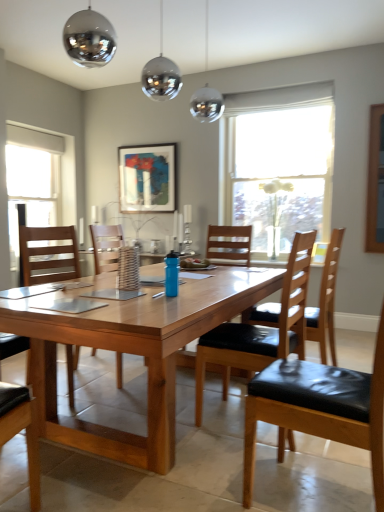
The height and width of the screenshot is (512, 384). Describe the element at coordinates (128, 269) in the screenshot. I see `woven brown basket at center` at that location.

This screenshot has width=384, height=512. What do you see at coordinates (171, 274) in the screenshot?
I see `blue matte water bottle at center` at bounding box center [171, 274].

What do you see at coordinates (326, 301) in the screenshot?
I see `black leather chair at right, marked as the fourth chair in a left-to-right arrangement` at bounding box center [326, 301].

This screenshot has width=384, height=512. I want to click on woven brown basket at center, so click(x=128, y=269).

Where is `desk on the left of the black leather chair at center, which ranks as the second chair in left-to-right order`? This screenshot has height=512, width=384. desk on the left of the black leather chair at center, which ranks as the second chair in left-to-right order is located at coordinates (132, 353).

Considering the relative sizes of black leather chair at center, which ranks as the second chair in left-to-right order, and wooden table at center in the image provided, is black leather chair at center, which ranks as the second chair in left-to-right order, bigger than wooden table at center?

No.

Is black leather chair at center, arranged as the 3th chair when viewed from the right, in contact with wooden table at center?

No, black leather chair at center, arranged as the 3th chair when viewed from the right, is not with wooden table at center.

Is black leather chair at center, arranged as the 3th chair when viewed from the right, oriented away from wooden table at center?

That's not correct — black leather chair at center, arranged as the 3th chair when viewed from the right, is not looking away from wooden table at center.

Between wooden chair at center, marked as the 4th chair in a right-to-left arrangement, and black leather chair at right, marked as the first chair in a right-to-left arrangement, which one is positioned behind?

black leather chair at right, marked as the first chair in a right-to-left arrangement, is behind.

Would you say wooden chair at center, marked as the 4th chair in a right-to-left arrangement, is a long distance from black leather chair at right, marked as the first chair in a right-to-left arrangement?

Yes, wooden chair at center, marked as the 4th chair in a right-to-left arrangement, and black leather chair at right, marked as the first chair in a right-to-left arrangement, are quite far apart.

Between wooden chair at center, marked as the 4th chair in a right-to-left arrangement, and black leather chair at right, marked as the fourth chair in a left-to-right arrangement, which one has less height?

wooden chair at center, marked as the 4th chair in a right-to-left arrangement, is shorter.

Who is smaller, wooden chair at center, arranged as the first chair when viewed from the left, or black leather chair at right, marked as the fourth chair in a left-to-right arrangement?

black leather chair at right, marked as the fourth chair in a left-to-right arrangement.

Is black leather chair at right, marked as the fourth chair in a left-to-right arrangement, bigger than white glass window at left, which ranks as the second window in right-to-left order?

Indeed, black leather chair at right, marked as the fourth chair in a left-to-right arrangement, has a larger size compared to white glass window at left, which ranks as the second window in right-to-left order.

Looking at their sizes, would you say black leather chair at right, marked as the fourth chair in a left-to-right arrangement, is wider or thinner than white glass window at left, the 1th window when ordered from left to right?

In the image, black leather chair at right, marked as the fourth chair in a left-to-right arrangement, appears to be wider than white glass window at left, the 1th window when ordered from left to right.

Which point is more forward, (x=332, y=253) or (x=9, y=169)?

The point (x=332, y=253) is more forward.

Considering the relative sizes of shiny metallic globe at upper center and matte black picture frame at upper center in the image provided, is shiny metallic globe at upper center smaller than matte black picture frame at upper center?

Incorrect, shiny metallic globe at upper center is not smaller in size than matte black picture frame at upper center.

From the image's perspective, between shiny metallic globe at upper center and matte black picture frame at upper center, who is located below?

matte black picture frame at upper center, from the image's perspective.

Consider the image. From a real-world perspective, is shiny metallic globe at upper center located beneath matte black picture frame at upper center?

No, from a real-world perspective, shiny metallic globe at upper center is not beneath matte black picture frame at upper center.

Which object is closer to the camera taking this photo, wooden table at center or white glass window at left, which ranks as the second window in right-to-left order?

wooden table at center is in front.

From the image's perspective, which is below, wooden table at center or white glass window at left, which ranks as the second window in right-to-left order?

wooden table at center.

The image size is (384, 512). In order to click on desk below the white glass window at left, the 1th window when ordered from left to right (from a real-world perspective) in this screenshot , I will do `click(132, 353)`.

Can you confirm if wooden table at center is positioned to the right of white glass window at left, the 1th window when ordered from left to right?

Yes, wooden table at center is to the right of white glass window at left, the 1th window when ordered from left to right.

Considering the relative sizes of blue matte water bottle at center and black leather chair at center, which ranks as the second chair in left-to-right order, in the image provided, is blue matte water bottle at center thinner than black leather chair at center, which ranks as the second chair in left-to-right order,?

Correct, the width of blue matte water bottle at center is less than that of black leather chair at center, which ranks as the second chair in left-to-right order.

Could you measure the distance between blue matte water bottle at center and black leather chair at center, arranged as the 3th chair when viewed from the right?

blue matte water bottle at center and black leather chair at center, arranged as the 3th chair when viewed from the right, are 25.39 inches apart from each other.

Are blue matte water bottle at center and black leather chair at center, which ranks as the second chair in left-to-right order, located far from each other?

They are positioned close to each other.

What's the angular difference between blue matte water bottle at center and black leather chair at center, arranged as the 3th chair when viewed from the right,'s facing directions?

They differ by 176 degrees in their facing directions.

Is wooden table at center positioned with its back to black leather chair at right, marked as the second chair in a right-to-left arrangement?

No, black leather chair at right, marked as the second chair in a right-to-left arrangement, is not at the back of wooden table at center.

Between point (155, 393) and point (271, 393), which one is positioned behind?

Positioned behind is point (155, 393).

Does wooden table at center have a greater height compared to black leather chair at right, marked as the second chair in a right-to-left arrangement?

In fact, wooden table at center may be shorter than black leather chair at right, marked as the second chair in a right-to-left arrangement.

How many degrees apart are the facing directions of wooden table at center and black leather chair at right, marked as the second chair in a right-to-left arrangement?

95.3 degrees.

You are a GUI agent. You are given a task and a screenshot of the screen. Output one action in this format:
    pyautogui.click(x=<x>, y=<y>)
    Task: Click on the chair that is the 1st one above the wooden table at center (from a real-world perspective)
    The height and width of the screenshot is (512, 384).
    Given the screenshot: What is the action you would take?
    pyautogui.click(x=261, y=327)

Starting from the black leather chair at right, marked as the first chair in a right-to-left arrangement, which chair is the 1st one in front? Please provide its 2D coordinates.

[(49, 252)]

Considering their positions, is shiny metallic globe at upper center positioned closer to matte black picture frame at upper center than black leather chair at right, acting as the 3th chair starting from the left?

shiny metallic globe at upper center lies closer to matte black picture frame at upper center than the other object.

When comparing their distances from clear glass vase at center, which appears as the second window when viewed from the left, does black leather chair at right, acting as the 3th chair starting from the left, or shiny metallic globe at upper center seem closer?

shiny metallic globe at upper center.

Consider the image. From the image, which object appears to be nearer to white glass window at left, the 1th window when ordered from left to right, shiny metallic globe at upper center or woven brown basket at center?

shiny metallic globe at upper center.

Considering their positions, is clear glass vase at center, placed as the first window when sorted from right to left, positioned further to wooden table at center than black leather chair at right, marked as the fourth chair in a left-to-right arrangement?

clear glass vase at center, placed as the first window when sorted from right to left.

Looking at the image, which one is located further to woven brown basket at center, black leather chair at right, marked as the first chair in a right-to-left arrangement, or wooden table at center?

black leather chair at right, marked as the first chair in a right-to-left arrangement, is further to woven brown basket at center.

When comparing their distances from wooden chair at center, arranged as the first chair when viewed from the left, does black leather chair at center, arranged as the 3th chair when viewed from the right, or matte black picture frame at upper center seem further?

matte black picture frame at upper center lies further to wooden chair at center, arranged as the first chair when viewed from the left, than the other object.

Consider the image. From the image, which object appears to be nearer to clear glass vase at center, which appears as the second window when viewed from the left, woven brown basket at center or black leather chair at center, arranged as the 3th chair when viewed from the right?

black leather chair at center, arranged as the 3th chair when viewed from the right, is closer to clear glass vase at center, which appears as the second window when viewed from the left.

Estimate the real-world distances between objects in this image. Which object is closer to black leather chair at right, marked as the first chair in a right-to-left arrangement, white glass window at left, the 1th window when ordered from left to right, or blue matte water bottle at center?

blue matte water bottle at center lies closer to black leather chair at right, marked as the first chair in a right-to-left arrangement, than the other object.

This screenshot has height=512, width=384. I want to click on chair located between wooden chair at center, marked as the 4th chair in a right-to-left arrangement, and clear glass vase at center, which appears as the second window when viewed from the left, in the depth direction, so click(326, 301).

The image size is (384, 512). In order to click on chair between wooden table at center and blue matte water bottle at center along the z-axis in this screenshot , I will do `click(261, 327)`.

Identify the location of coffee cup between shiny metallic globe at upper center and black leather chair at right, marked as the fourth chair in a left-to-right arrangement, vertically. (128, 269).

Where is `lamp positioned between wooden table at center and white glass window at left, which ranks as the second window in right-to-left order, from near to far`? lamp positioned between wooden table at center and white glass window at left, which ranks as the second window in right-to-left order, from near to far is located at coordinates (207, 104).